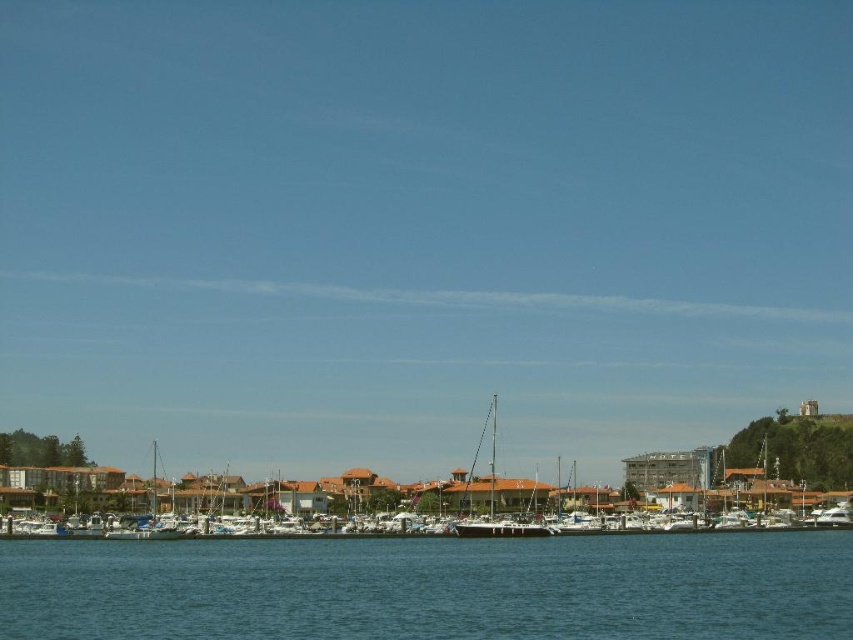
Question: Can you confirm if clear blue water at lower center is thinner than white matte boats at center?

Choices:
 (A) yes
 (B) no

Answer: (A)

Question: Can you confirm if clear blue water at lower center is positioned to the left of white glossy sailboat at center?

Choices:
 (A) yes
 (B) no

Answer: (A)

Question: Among these points, which one is nearest to the camera?

Choices:
 (A) (532, 490)
 (B) (807, 496)

Answer: (A)

Question: In this image, where is clear blue water at lower center located relative to white matte boats at center?

Choices:
 (A) right
 (B) left

Answer: (B)

Question: Which of the following is the farthest from the observer?

Choices:
 (A) white glossy sailboat at center
 (B) clear blue water at lower center

Answer: (A)

Question: Which of these objects is positioned closest to the clear blue water at lower center?

Choices:
 (A) white glossy sailboat at center
 (B) white matte boats at center

Answer: (A)